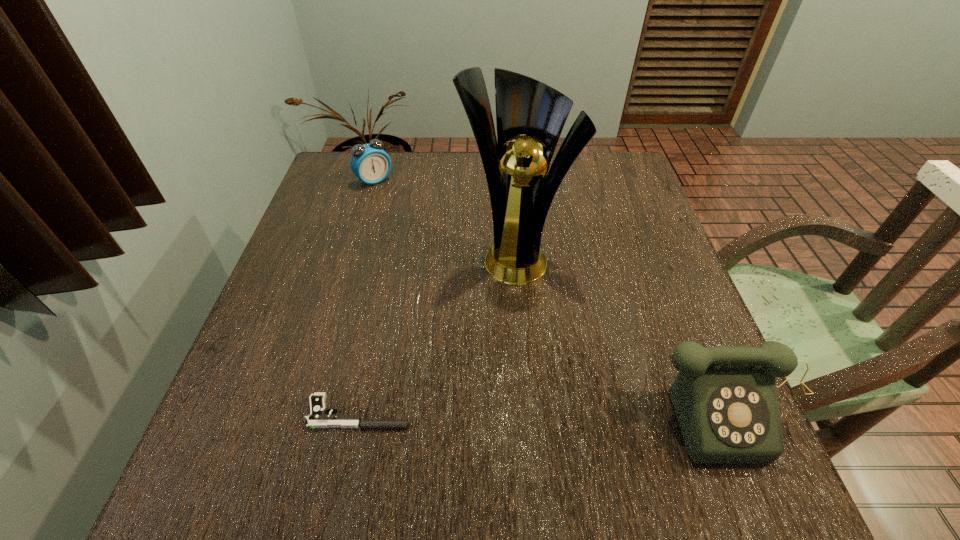
Locate an element on the screen. The height and width of the screenshot is (540, 960). free space located 0.160m at the front of the tallest object, where the globe is visible is located at coordinates (507, 343).

Locate an element on the screen. The height and width of the screenshot is (540, 960). vacant area situated on the face of the third tallest object is located at coordinates (422, 230).

Locate an element on the screen. The height and width of the screenshot is (540, 960). free space located on the face of the third tallest object is located at coordinates (430, 238).

You are a GUI agent. You are given a task and a screenshot of the screen. Output one action in this format:
    pyautogui.click(x=<x>, y=<y>)
    Task: Click on the vacant region located 0.070m on the face of the third tallest object
    
    Given the screenshot: What is the action you would take?
    pyautogui.click(x=395, y=200)

You are a GUI agent. You are given a task and a screenshot of the screen. Output one action in this format:
    pyautogui.click(x=<x>, y=<y>)
    Task: Click on the object that is positioned at the far edge
    The image size is (960, 540).
    Given the screenshot: What is the action you would take?
    pyautogui.click(x=370, y=163)

I want to click on pistol at the near edge, so click(x=318, y=418).

Where is `telephone present at the near edge`? This screenshot has height=540, width=960. telephone present at the near edge is located at coordinates (725, 400).

The height and width of the screenshot is (540, 960). I want to click on pistol that is at the left edge, so click(318, 418).

The height and width of the screenshot is (540, 960). Identify the location of alarm clock that is at the left edge. (370, 163).

Locate an element on the screen. Image resolution: width=960 pixels, height=540 pixels. object that is at the right edge is located at coordinates (725, 400).